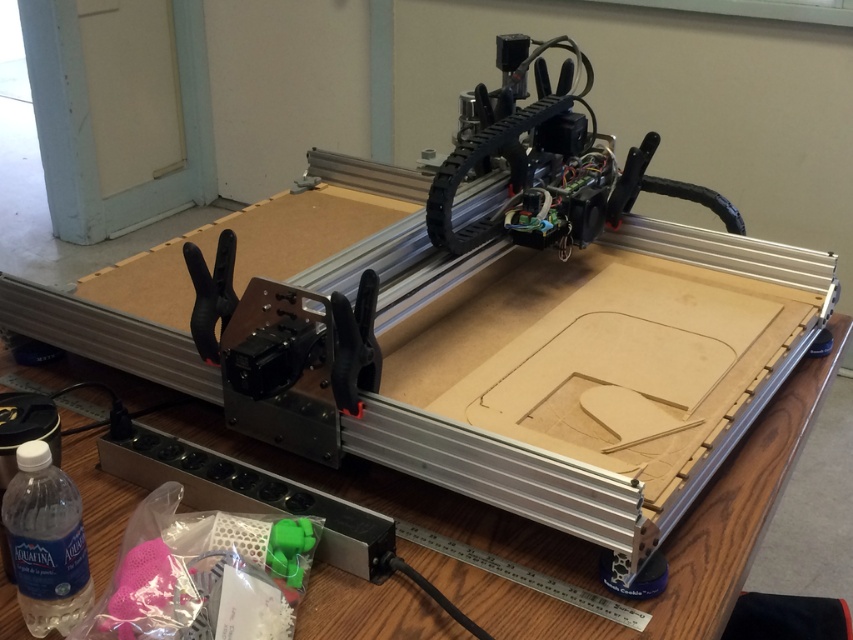
Question: Is wooden table at center smaller than clear plastic bottle at lower left?

Choices:
 (A) yes
 (B) no

Answer: (B)

Question: Does wooden table at center have a larger size compared to clear plastic bottle at lower left?

Choices:
 (A) no
 (B) yes

Answer: (B)

Question: Which point is farther to the camera?

Choices:
 (A) (779, 374)
 (B) (26, 451)

Answer: (A)

Question: Is wooden table at center thinner than clear plastic bottle at lower left?

Choices:
 (A) yes
 (B) no

Answer: (B)

Question: Which of the following is the closest to the observer?

Choices:
 (A) wooden table at center
 (B) clear plastic bottle at lower left

Answer: (B)

Question: Which object is closer to the camera taking this photo?

Choices:
 (A) clear plastic bottle at lower left
 (B) wooden table at center

Answer: (A)